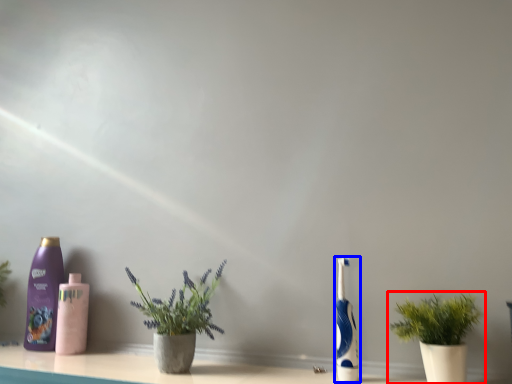
Question: Which object appears farthest to the camera in this image, houseplant (highlighted by a red box) or toothbrush (highlighted by a blue box)?

Choices:
 (A) houseplant
 (B) toothbrush

Answer: (B)